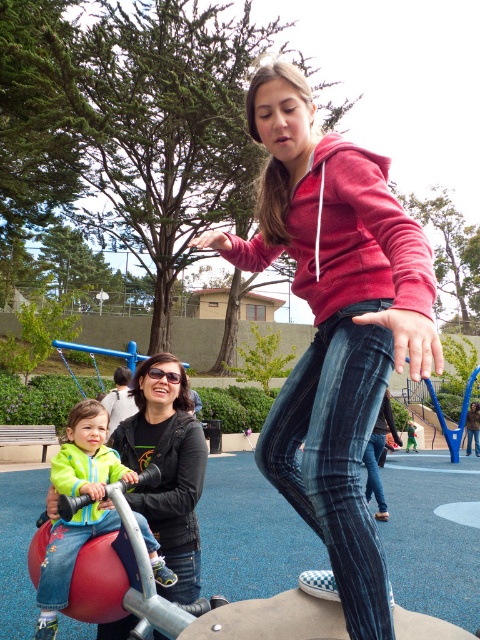
Looking at this image, can you confirm if matte red hoodie at center is positioned to the right of green fleece jacket at center?

Indeed, matte red hoodie at center is positioned on the right side of green fleece jacket at center.

Locate an element on the screen. Image resolution: width=480 pixels, height=640 pixels. matte red hoodie at center is located at coordinates (335, 328).